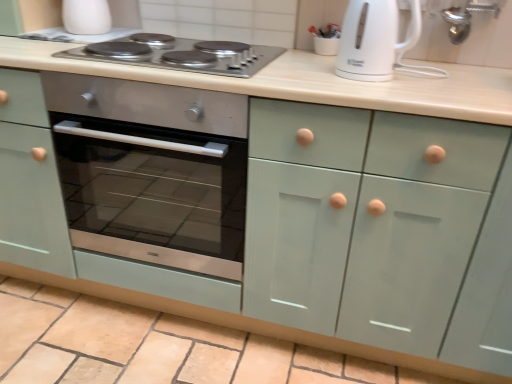
You are a GUI agent. You are given a task and a screenshot of the screen. Output one action in this format:
    pyautogui.click(x=<x>, y=<y>)
    Task: Click on the free space to the left of white glossy cup at upper left
    
    Given the screenshot: What is the action you would take?
    pyautogui.click(x=34, y=38)